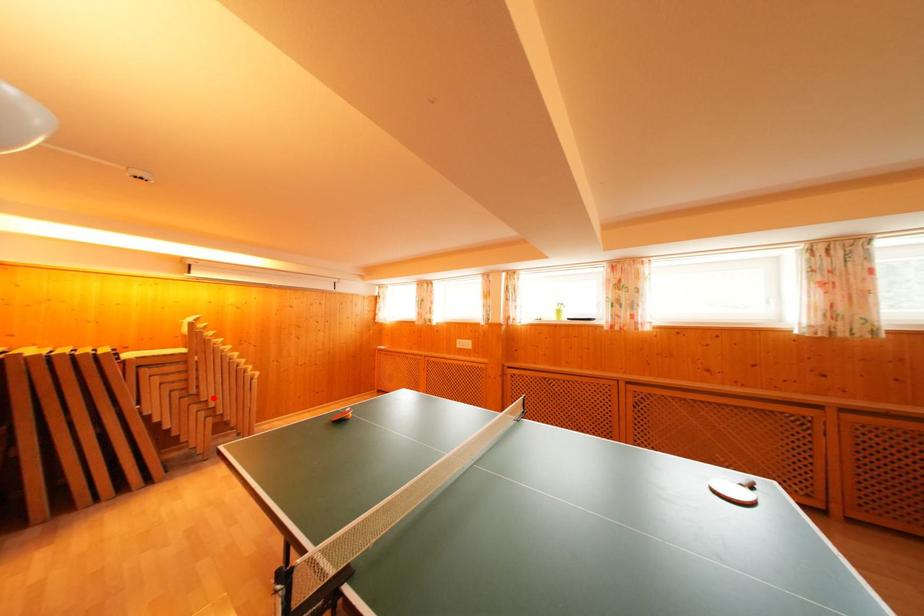
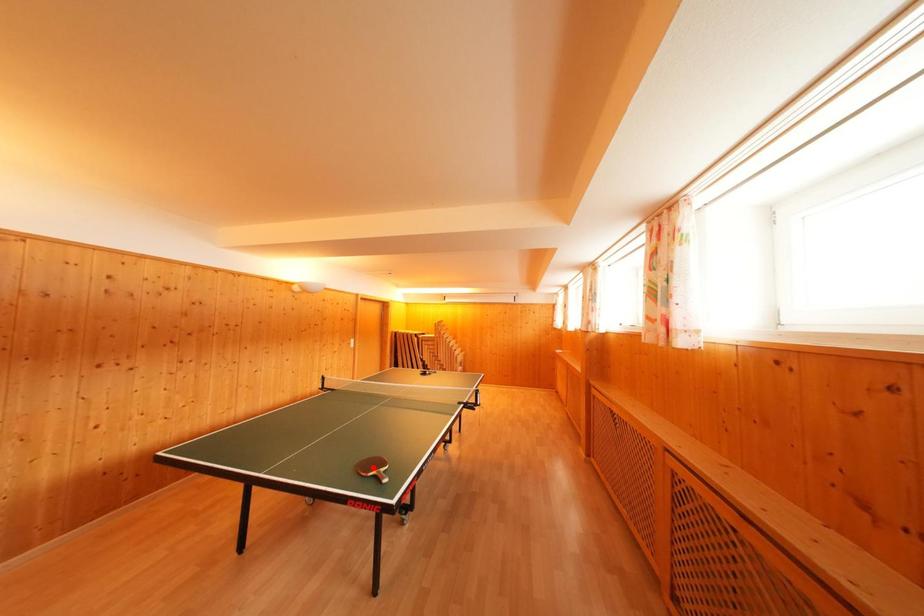
I am providing you with two images of the same scene from different viewpoints. A red point is marked on the first image and another point is marked on the second image. Is the red point in image1 aligned with the point shown in image2?

No